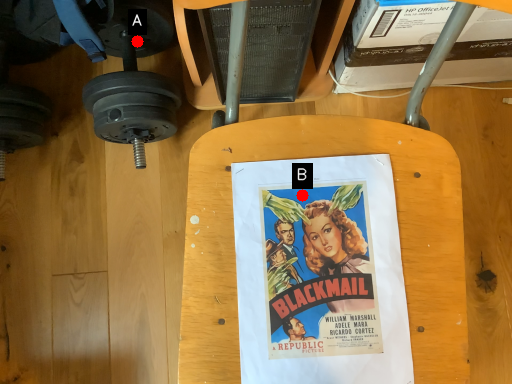
Question: Two points are circled on the image, labeled by A and B beside each circle. Which of the following is the closest to the observer?

Choices:
 (A) A is closer
 (B) B is closer

Answer: (B)